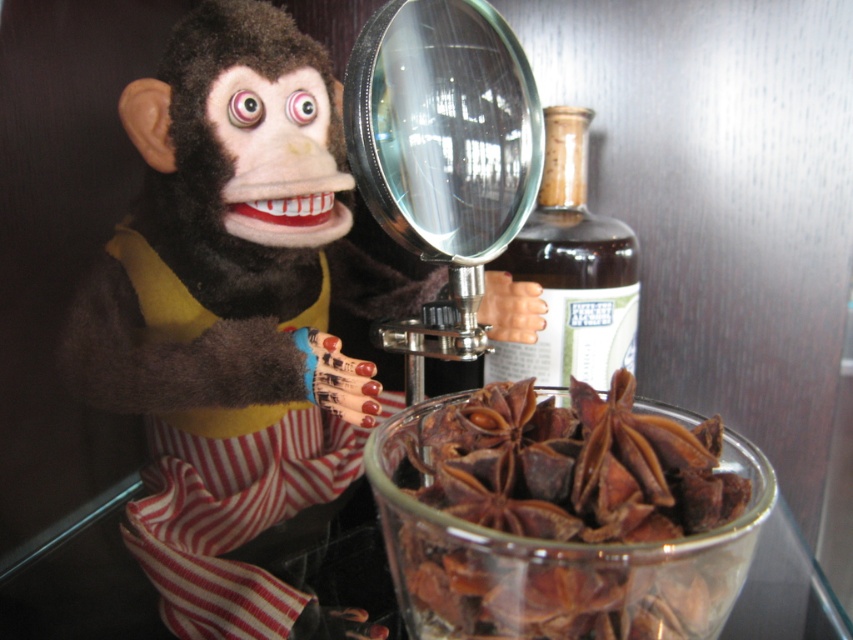
You are a puppeteer trying to determine which object has a smaller width between the transparent glass magnifying glass at center and the brown glass bottle at center. Based on the scene, which one is narrower?

The transparent glass magnifying glass at center has a smaller width than the brown glass bottle at center, making it narrower.

You are a curious explorer examining the scene. You notice the velvet plush monkey at center and the brown papery star anise at center. Which object is taller?

The velvet plush monkey at center is much taller than the brown papery star anise at center.